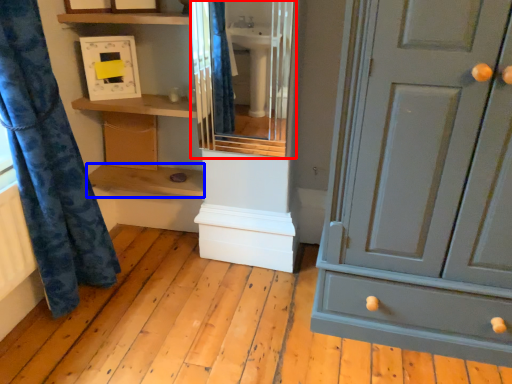
Question: Which point is closer to the camera, cabinet (highlighted by a red box) or shelf (highlighted by a blue box)?

Choices:
 (A) cabinet
 (B) shelf

Answer: (A)